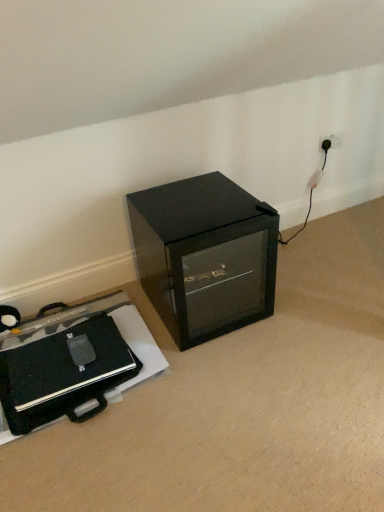
Question: From the image's perspective, is black matte briefcase at lower left located above or below black glass cabinet at center?

Choices:
 (A) above
 (B) below

Answer: (B)

Question: Looking at their shapes, would you say black matte briefcase at lower left is wider or thinner than black glass cabinet at center?

Choices:
 (A) thin
 (B) wide

Answer: (A)

Question: Is point (69, 388) closer or farther from the camera than point (198, 309)?

Choices:
 (A) farther
 (B) closer

Answer: (B)

Question: From the image's perspective, is black glass cabinet at center positioned above or below black matte briefcase at lower left?

Choices:
 (A) below
 (B) above

Answer: (B)

Question: In terms of height, does black glass cabinet at center look taller or shorter compared to black matte briefcase at lower left?

Choices:
 (A) tall
 (B) short

Answer: (A)

Question: Is black glass cabinet at center spatially inside black matte briefcase at lower left, or outside of it?

Choices:
 (A) inside
 (B) outside

Answer: (B)

Question: Is black glass cabinet at center in front of or behind black matte briefcase at lower left in the image?

Choices:
 (A) behind
 (B) front

Answer: (A)